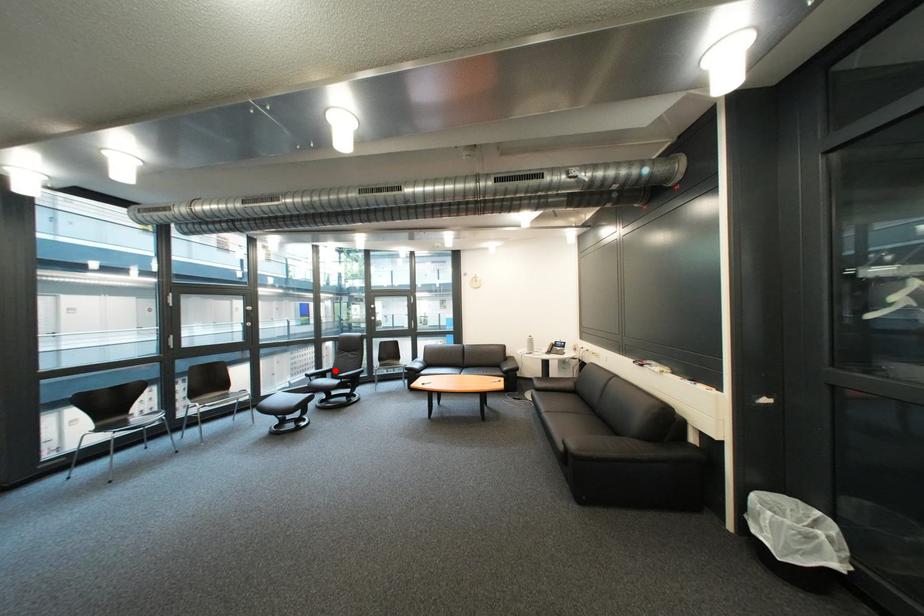
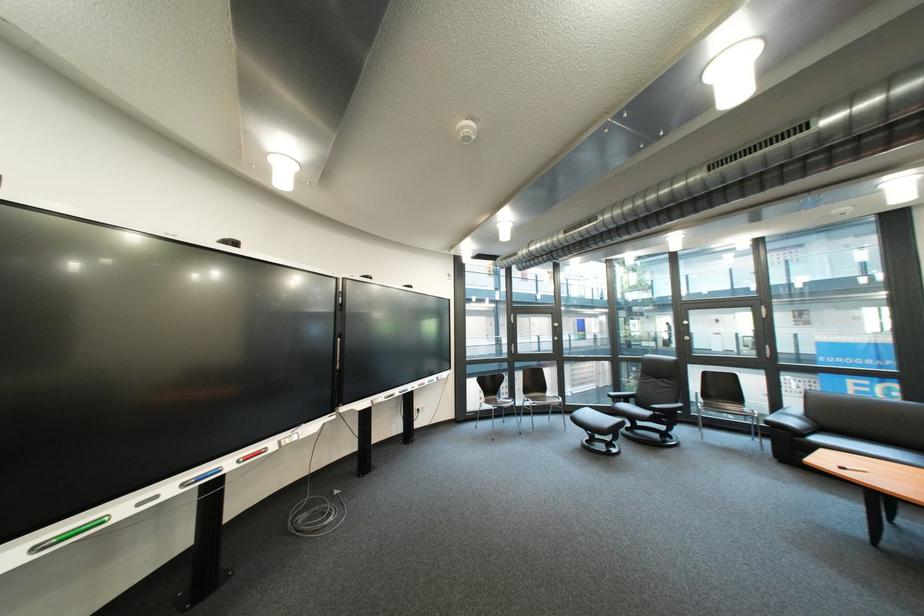
Question: I am providing you with two images of the same scene from different viewpoints. A red point is marked on the first image. Can you still see the location of the red point in image 2?

Choices:
 (A) Yes
 (B) No

Answer: (A)